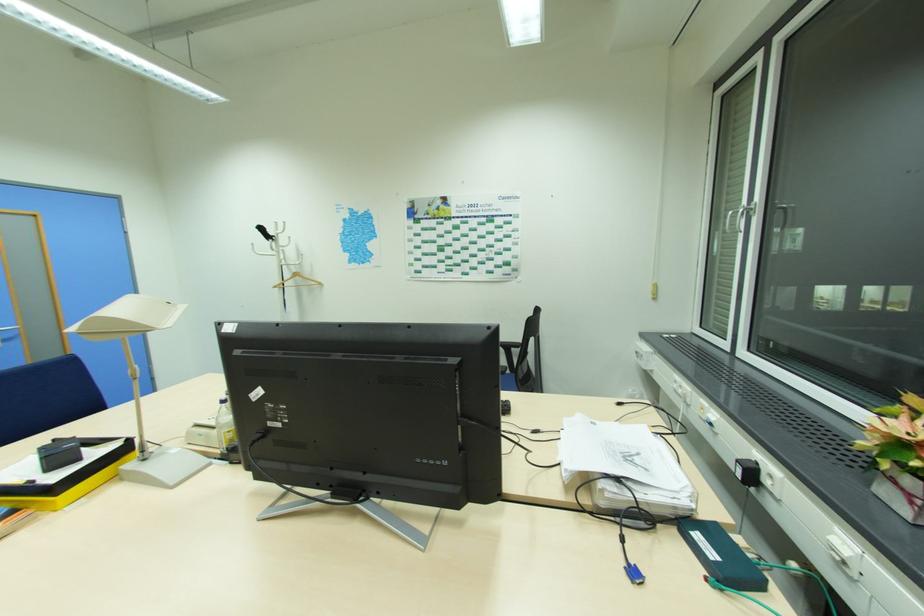
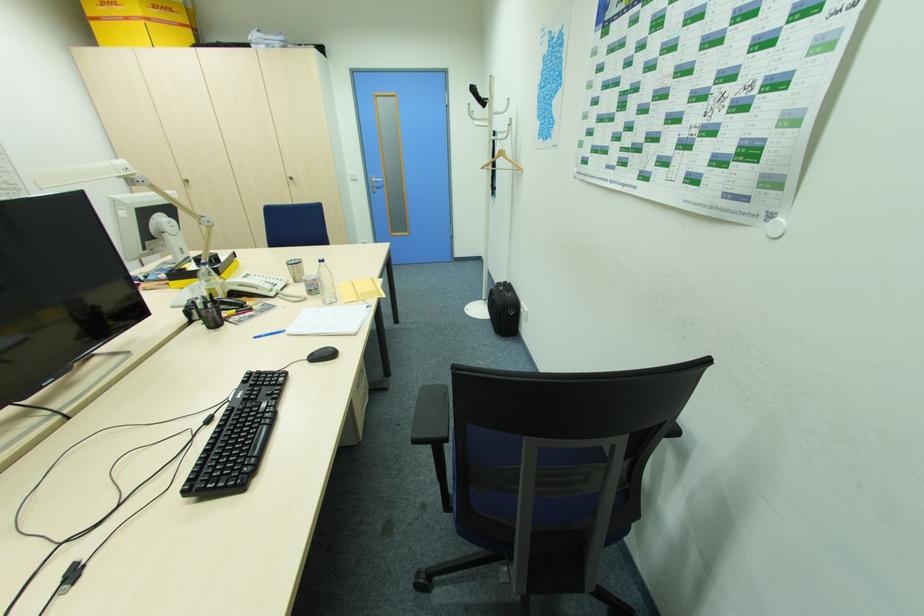
Find the pixel in the second image that matches point (281, 246) in the first image.

(493, 113)